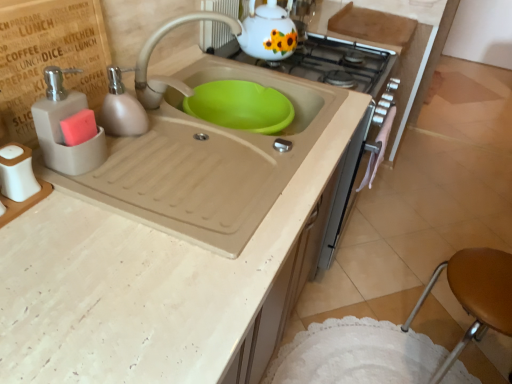
I want to click on vacant space in brown leather stool at lower right (from a real-world perspective), so click(x=453, y=360).